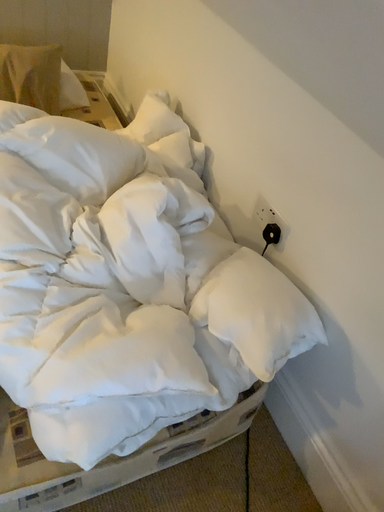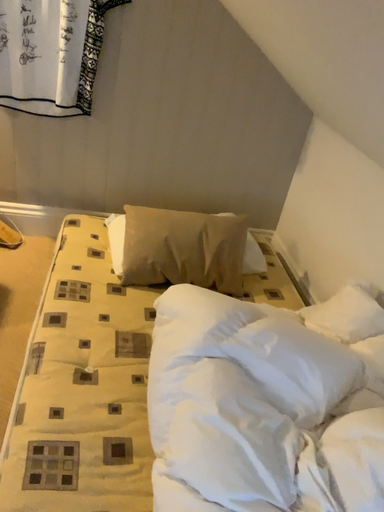
Question: Which way did the camera rotate in the video?

Choices:
 (A) rotated right
 (B) rotated left

Answer: (B)